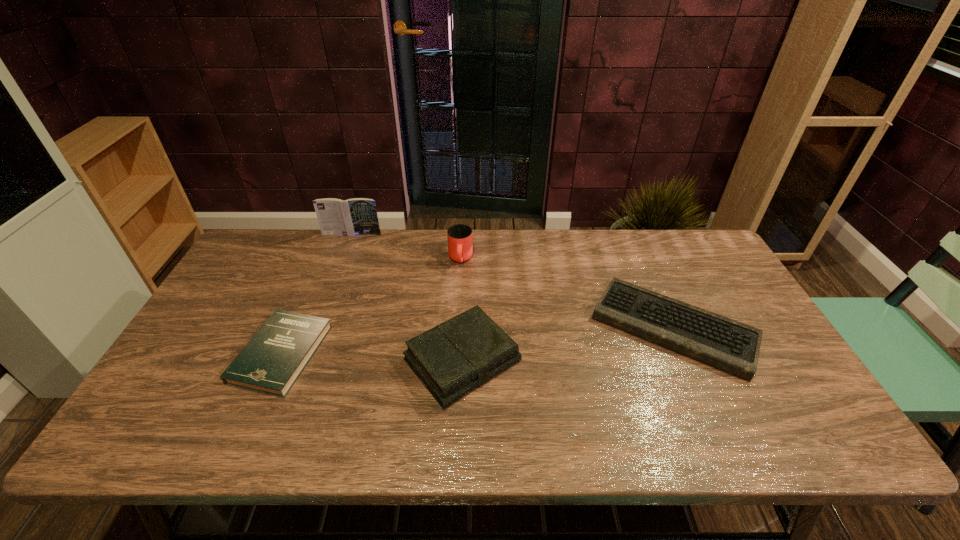
I want to click on object that ranks as the second closest to the third tallest object, so click(x=460, y=247).

This screenshot has height=540, width=960. Identify the location of object that is the fourth nearest to the shortest book. (721, 342).

The width and height of the screenshot is (960, 540). I want to click on the closest book to the tallest object, so click(271, 362).

At what (x,y) coordinates should I click in order to perform the action: click on the second closest book relative to the shortest book. Please return your answer as a coordinate pair (x, y). The height and width of the screenshot is (540, 960). Looking at the image, I should click on (358, 216).

This screenshot has height=540, width=960. Find the location of `vacant area in the image that satisfies the following two spatial constraints: 1. on the handle side of the rightmost object; 2. on the right side of the second farthest object`. vacant area in the image that satisfies the following two spatial constraints: 1. on the handle side of the rightmost object; 2. on the right side of the second farthest object is located at coordinates (457, 327).

Identify the location of vacant space that satisfies the following two spatial constraints: 1. on the handle side of the computer keyboard; 2. on the left side of the cup. This screenshot has height=540, width=960. (457, 327).

Find the location of a particular element. free point that satisfies the following two spatial constraints: 1. on the handle side of the third shortest object; 2. on the right side of the cup is located at coordinates (455, 360).

This screenshot has height=540, width=960. Identify the location of vacant point that satisfies the following two spatial constraints: 1. on the front cover of the farthest book; 2. on the right side of the second tallest book. (304, 360).

Where is `free space that satisfies the following two spatial constraints: 1. on the front cover of the rightmost book; 2. on the left side of the farthest book`? free space that satisfies the following two spatial constraints: 1. on the front cover of the rightmost book; 2. on the left side of the farthest book is located at coordinates (304, 360).

The height and width of the screenshot is (540, 960). I want to click on vacant space that satisfies the following two spatial constraints: 1. on the handle side of the rightmost object; 2. on the right side of the fourth nearest object, so tap(457, 327).